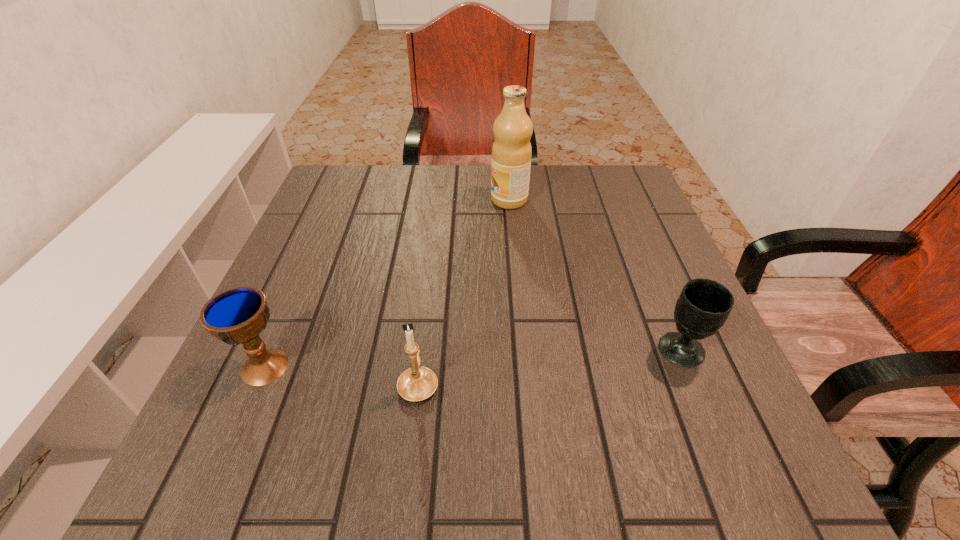
In the image, there is a desktop. At what (x,y) coordinates should I click in order to perform the action: click on vacant space at the far left corner. Please return your answer as a coordinate pair (x, y). This screenshot has width=960, height=540. Looking at the image, I should click on (321, 210).

This screenshot has width=960, height=540. I want to click on free point at the far right corner, so click(596, 183).

In the image, there is a desktop. Where is `blank space at the near right corner`? Image resolution: width=960 pixels, height=540 pixels. blank space at the near right corner is located at coordinates (770, 484).

Find the location of a particular element. The height and width of the screenshot is (540, 960). vacant region between the candle holder and the right chalice is located at coordinates (550, 367).

Locate an element on the screen. The width and height of the screenshot is (960, 540). vacant space in between the leftmost object and the third object from right to left is located at coordinates (342, 375).

Find the location of `vacant point located between the leftmost object and the third object from left to right`. vacant point located between the leftmost object and the third object from left to right is located at coordinates (387, 283).

Locate an element on the screen. This screenshot has width=960, height=540. empty space between the left chalice and the rightmost object is located at coordinates (473, 359).

The height and width of the screenshot is (540, 960). I want to click on free spot between the second object from left to right and the farthest object, so click(x=464, y=292).

Find the location of `free spot between the candle holder and the tallest object`. free spot between the candle holder and the tallest object is located at coordinates (464, 292).

The image size is (960, 540). I want to click on empty space between the candle holder and the leftmost object, so click(342, 375).